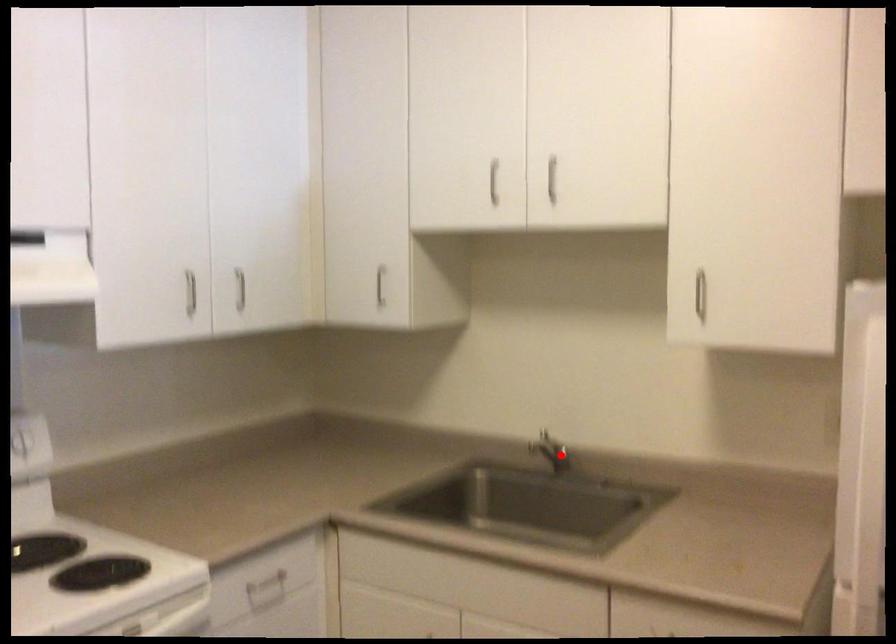
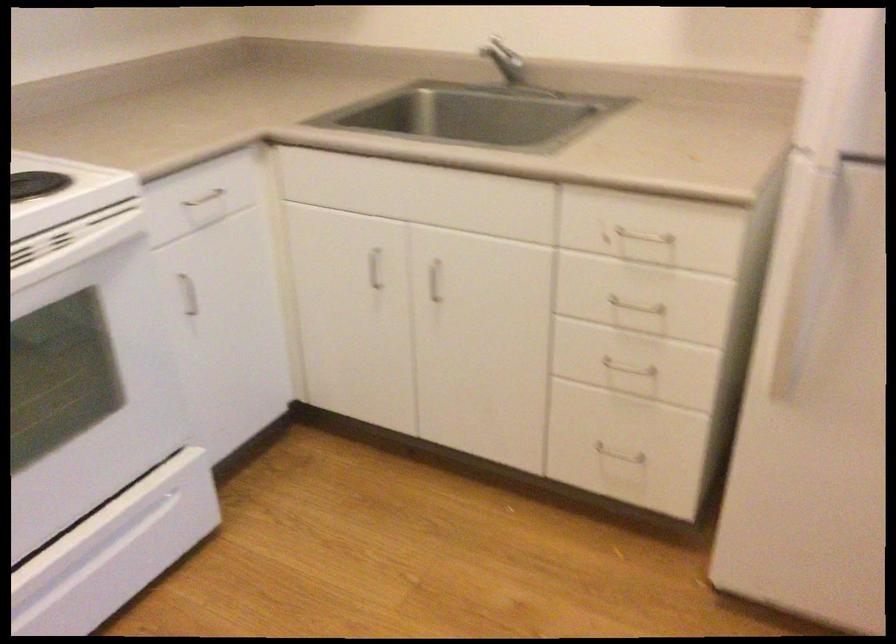
The point at the highlighted location is marked in the first image. Where is the corresponding point in the second image?

(510, 68)